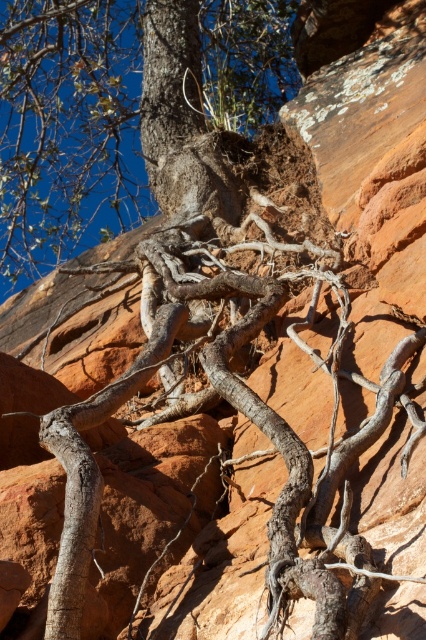
You are standing at the base of the rock formation and want to estimate how far the smooth bark tree trunk at upper center is from your current position. Based on the scene, what is the approximate distance?

The smooth bark tree trunk at upper center is approximately 30.79 meters away from the viewer, so the distance from your current position to the smooth bark tree trunk at upper center is about 30.79 meters.

Based on the scene description, where is the gray rough bark tree at center located in terms of its 2D coordinates?

The gray rough bark tree at center is located at the 2D coordinates point (66, 125).